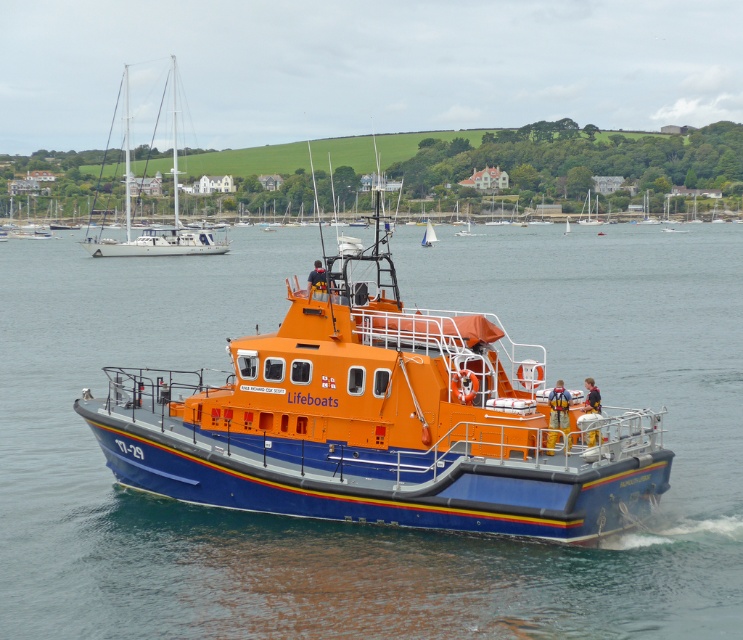
You are a sailor trying to navigate your boat to the harbor. You see an orange matte sailboat at upper left and an orange matte lifeboat at center in your path. Which boat should you avoid to prevent collision?

You should avoid the orange matte sailboat at upper left because it is in front of the orange matte lifeboat at center, making it closer to your current position.

You are a drone operator trying to capture the blue water at center from above. What are the coordinates you should aim for?

The coordinates for the blue water at center are at point (x=354, y=522).

You are a sailor on the orange matte lifeboat at center and you want to signal the orange matte sailboat at upper left using a flare. The flare can travel up to 25 meters. Will the flare reach the sailboat?

The distance between the orange matte sailboat at upper left and the orange matte lifeboat at center is 27.12 meters, which is beyond the 25 meter range of the flare. The flare will not reach the sailboat.